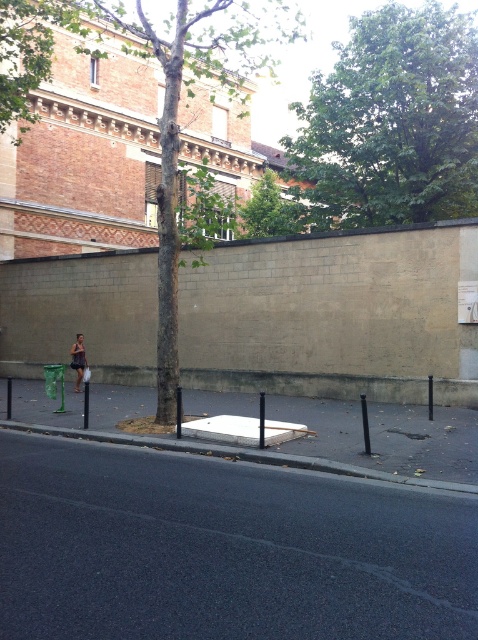
Question: Which is nearer to the green leafy tree at center?

Choices:
 (A) green textured tree at center
 (B) black asphalt at lower center
 (C) dark brown leather bag at lower left

Answer: (A)

Question: Can you confirm if black asphalt at lower center is smaller than gray concrete curb at lower center?

Choices:
 (A) yes
 (B) no

Answer: (A)

Question: Among these objects, which one is nearest to the camera?

Choices:
 (A) gray concrete curb at lower center
 (B) dark brown leather bag at lower left

Answer: (A)

Question: Is black asphalt at lower center to the left of green leafy tree at upper center from the viewer's perspective?

Choices:
 (A) yes
 (B) no

Answer: (A)

Question: Can you confirm if green textured tree at center is smaller than green leafy tree at center?

Choices:
 (A) no
 (B) yes

Answer: (A)

Question: Which of the following is the farthest from the observer?

Choices:
 (A) (10, 600)
 (B) (173, 243)
 (C) (63, 428)
 (D) (265, 220)

Answer: (D)